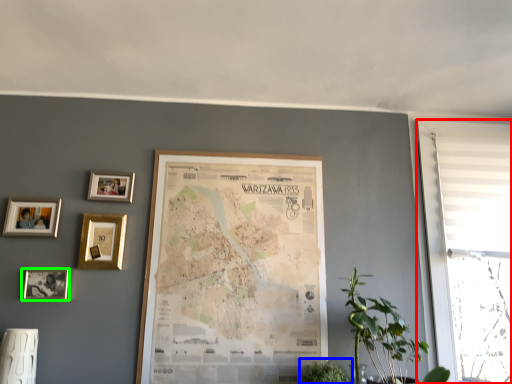
Question: Based on their relative distances, which object is nearer to window (highlighted by a red box)? Choose from houseplant (highlighted by a blue box) and picture frame (highlighted by a green box).

Choices:
 (A) houseplant
 (B) picture frame

Answer: (A)